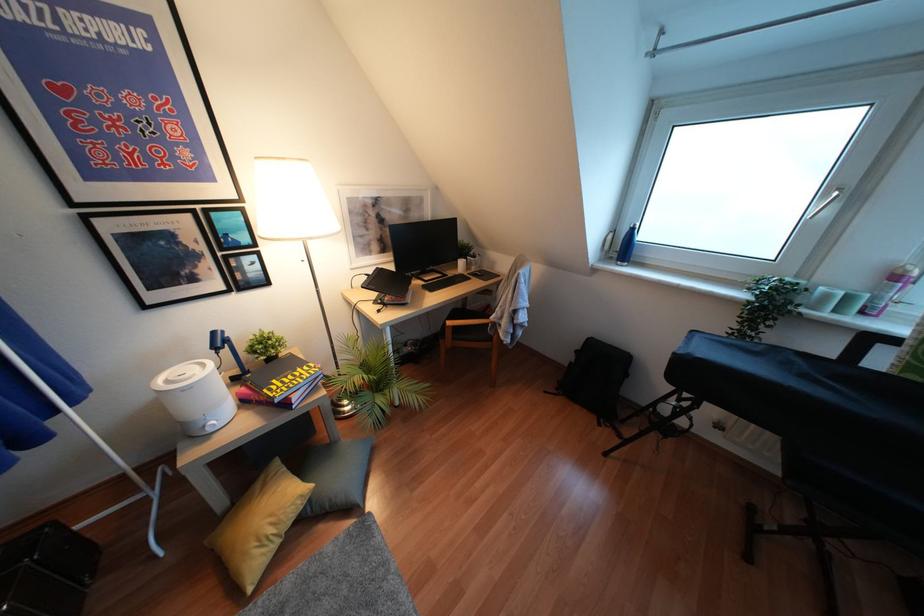
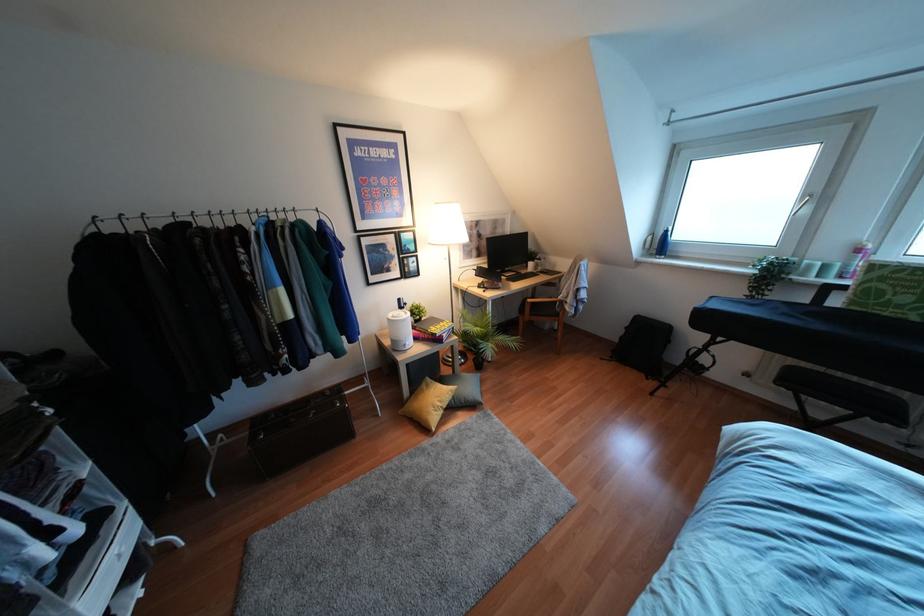
Find the pixel in the second image that matches (x=298, y=370) in the first image.

(441, 323)